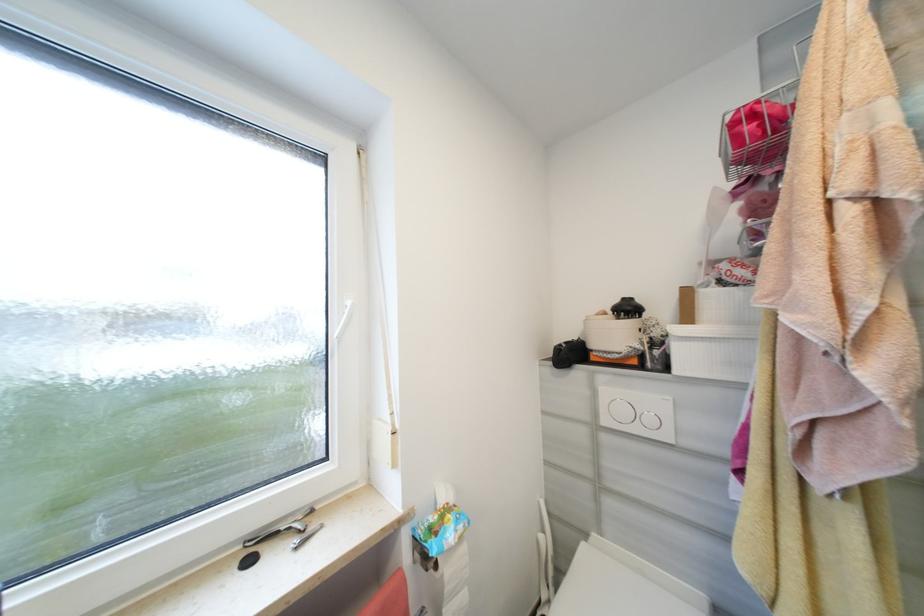
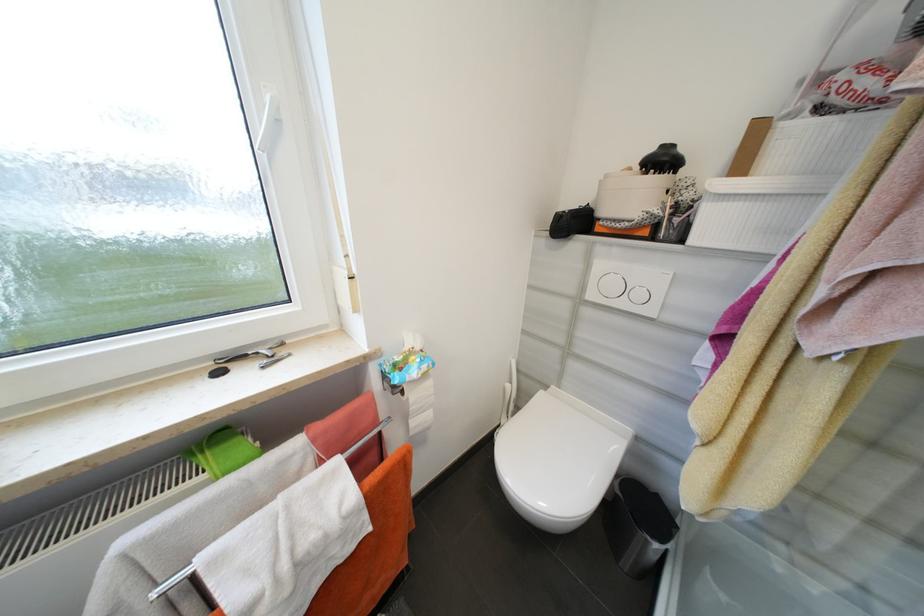
The point at (591, 537) is marked in the first image. Where is the corresponding point in the second image?

(552, 387)